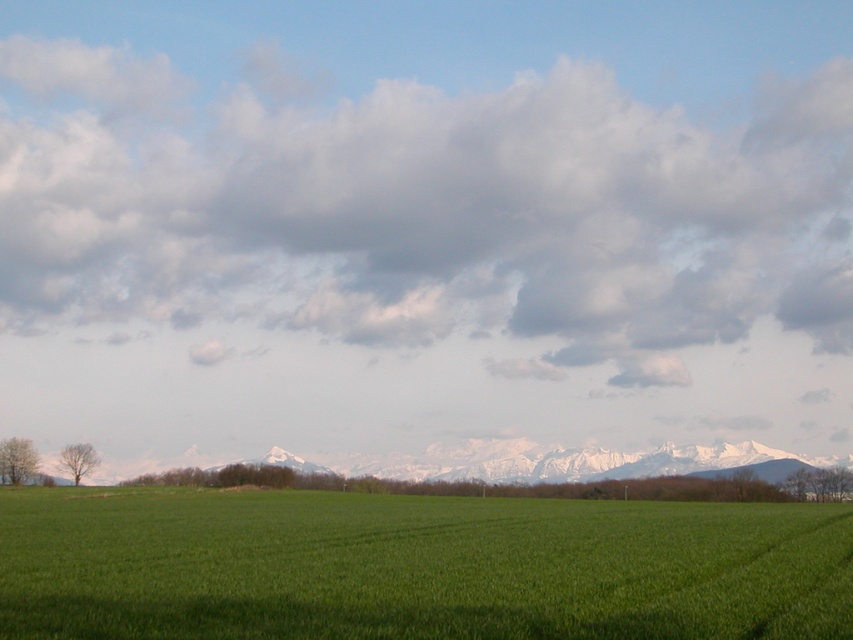
Question: Which object is closer to the camera taking this photo?

Choices:
 (A) cloudy sky at upper center
 (B) white snow-covered mountain range at center

Answer: (B)

Question: Which of the following is the closest to the observer?

Choices:
 (A) green grass at center
 (B) cloudy sky at upper center
 (C) white snow-covered mountain range at center

Answer: (A)

Question: Is cloudy sky at upper center wider than green grass at center?

Choices:
 (A) yes
 (B) no

Answer: (A)

Question: Is the position of cloudy sky at upper center more distant than that of green grass at center?

Choices:
 (A) no
 (B) yes

Answer: (B)

Question: Is cloudy sky at upper center thinner than white snow-covered mountain range at center?

Choices:
 (A) yes
 (B) no

Answer: (B)

Question: Which point is farther to the camera?

Choices:
 (A) (483, 221)
 (B) (502, 502)
 (C) (277, 452)

Answer: (A)